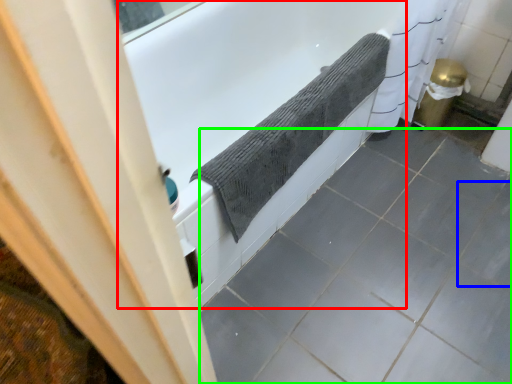
Question: Which object is the closest to the bathtub (highlighted by a red box)? Choose among these: ceramic tile (highlighted by a blue box) or ceramic tile (highlighted by a green box).

Choices:
 (A) ceramic tile
 (B) ceramic tile

Answer: (B)